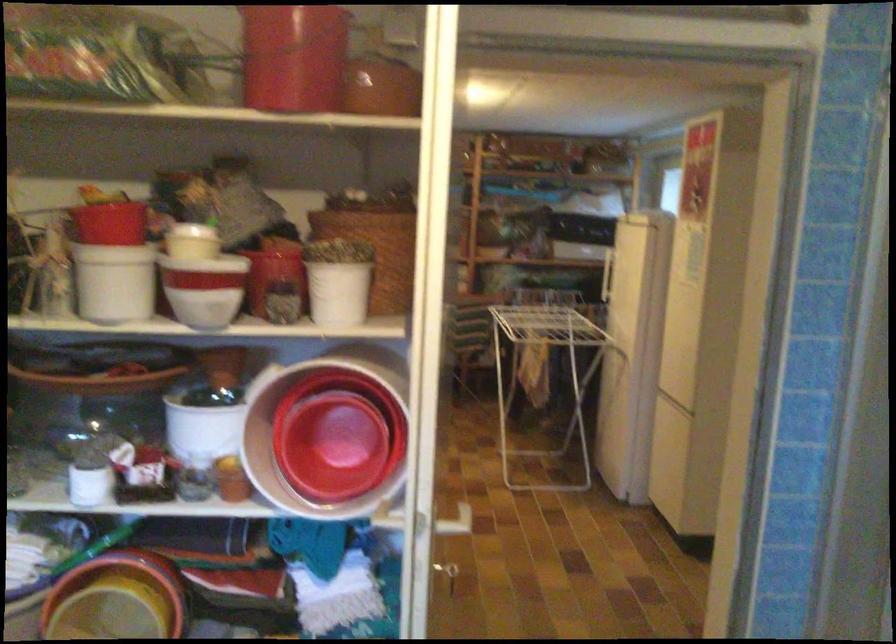
Image resolution: width=896 pixels, height=644 pixels. Describe the element at coordinates (449, 574) in the screenshot. I see `the door frame key` at that location.